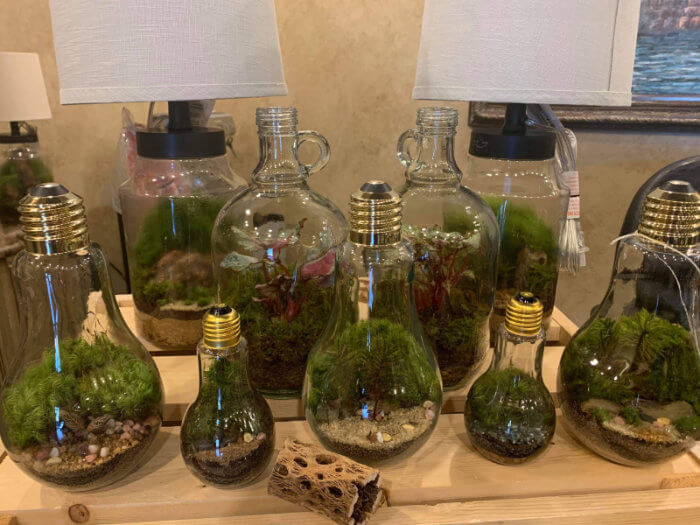
Image resolution: width=700 pixels, height=525 pixels. I want to click on lampshade, so click(x=573, y=34), click(x=180, y=51), click(x=15, y=84).